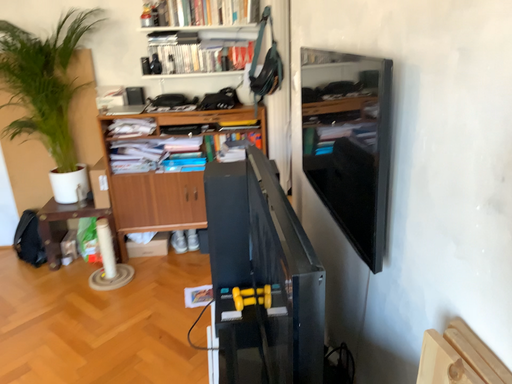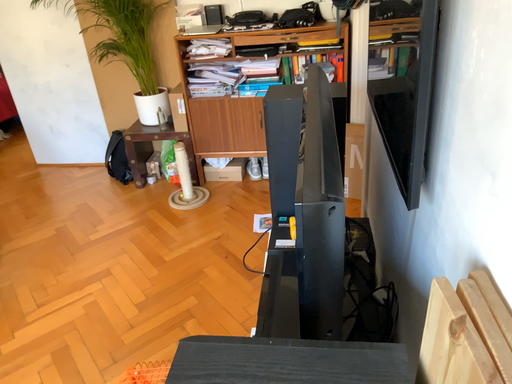
Question: How did the camera likely rotate when shooting the video?

Choices:
 (A) rotated downward
 (B) rotated upward

Answer: (A)